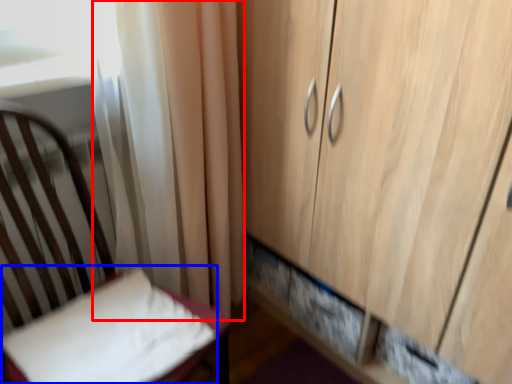
Question: Which point is closer to the camera, curtain (highlighted by a red box) or pillow (highlighted by a blue box)?

Choices:
 (A) curtain
 (B) pillow

Answer: (B)